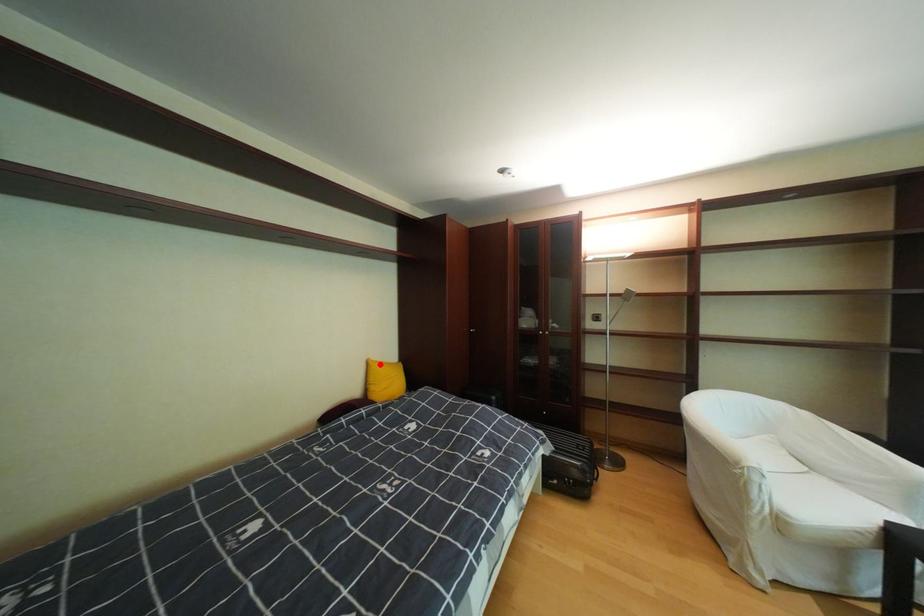
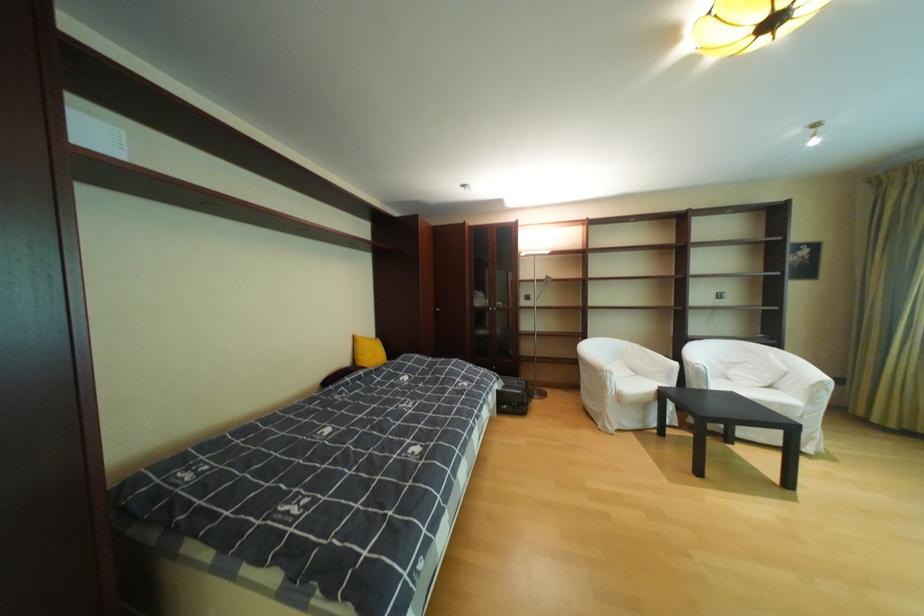
Where in the second image is the point corresponding to the highlighted location from the first image?

(367, 339)